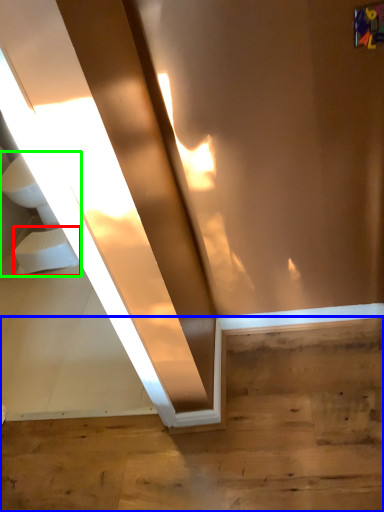
Question: Which is farther away from toilet bowl (highlighted by a red box)? stairwell (highlighted by a blue box) or sink (highlighted by a green box)?

Choices:
 (A) stairwell
 (B) sink

Answer: (A)